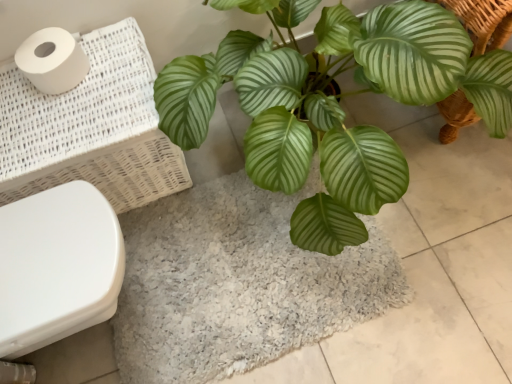
Locate an element on the screen. Image resolution: width=512 pixels, height=384 pixels. vacant space in front of white matte toilet paper at upper left is located at coordinates (62, 119).